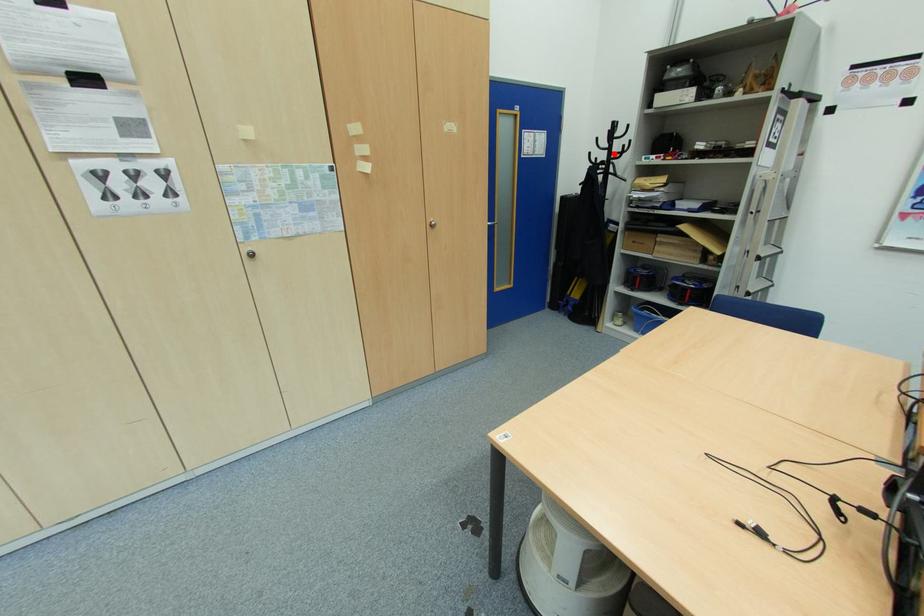
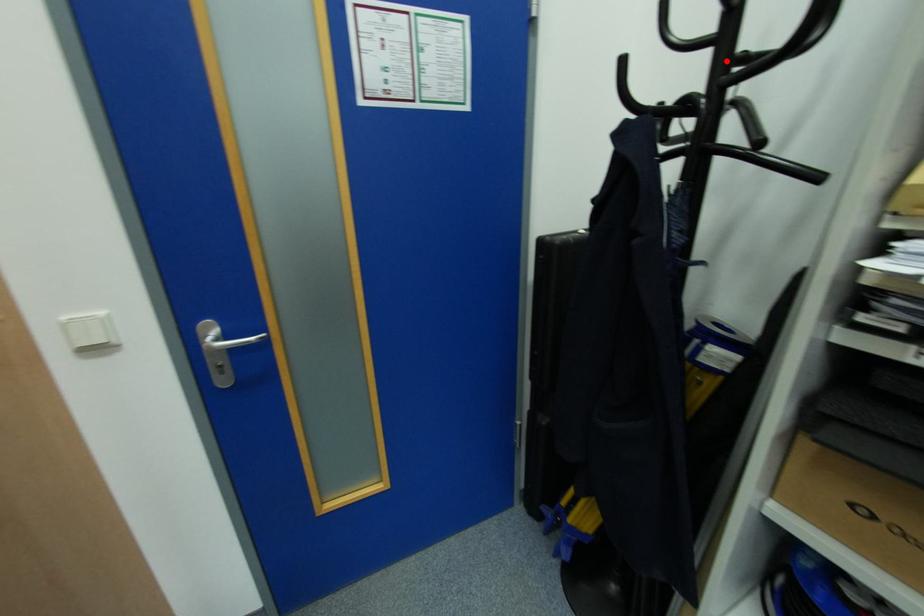
I am providing you with two images of the same scene from different viewpoints. A red point is marked on the first image and another point is marked on the second image. Do the highlighted points in image1 and image2 indicate the same real-world spot?

Yes